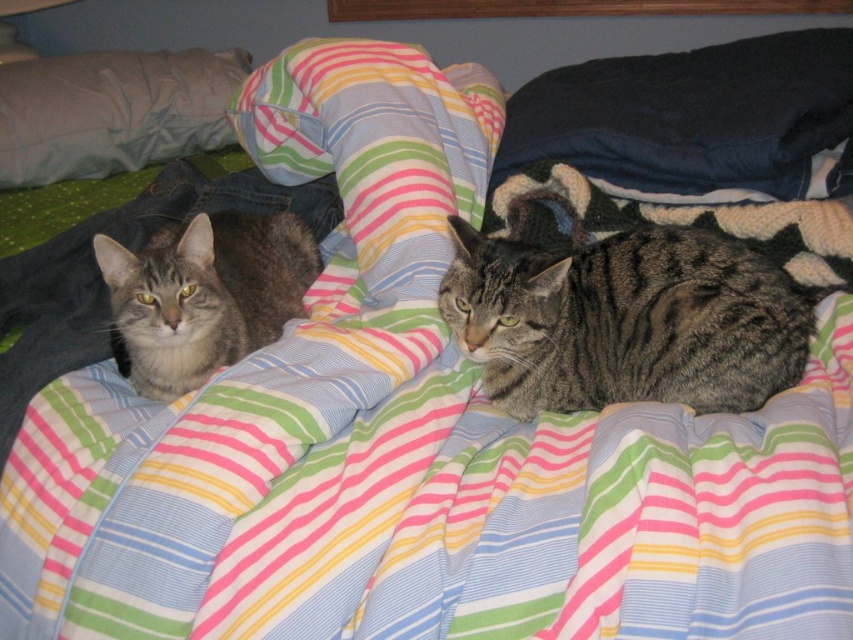
Does gray tabby cat at center have a greater width compared to pillow at upper left?

In fact, gray tabby cat at center might be narrower than pillow at upper left.

Does point (498, 292) come farther from viewer compared to point (59, 160)?

No, (498, 292) is closer to viewer.

You are a GUI agent. You are given a task and a screenshot of the screen. Output one action in this format:
    pyautogui.click(x=<x>, y=<y>)
    Task: Click on the gray tabby cat at center
    
    Given the screenshot: What is the action you would take?
    pyautogui.click(x=625, y=321)

Does gray tabby cat at left have a lesser height compared to pillow at upper left?

Correct, gray tabby cat at left is not as tall as pillow at upper left.

This screenshot has height=640, width=853. I want to click on gray tabby cat at left, so click(204, 294).

Who is higher up, dark blue fabric pillow at upper right or gray tabby cat at left?

dark blue fabric pillow at upper right is higher up.

Does dark blue fabric pillow at upper right appear on the left side of gray tabby cat at left?

In fact, dark blue fabric pillow at upper right is to the right of gray tabby cat at left.

The height and width of the screenshot is (640, 853). Find the location of `dark blue fabric pillow at upper right`. dark blue fabric pillow at upper right is located at coordinates (689, 115).